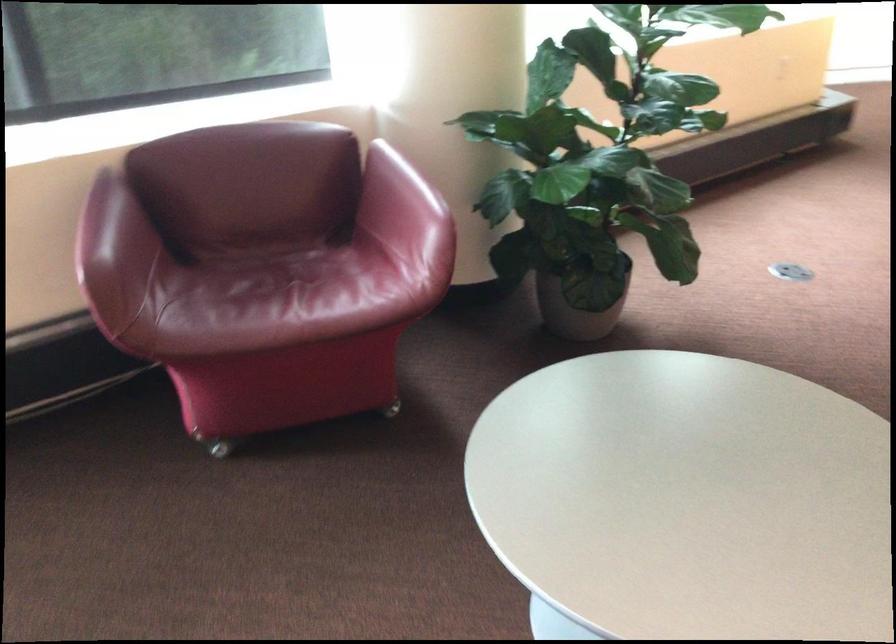
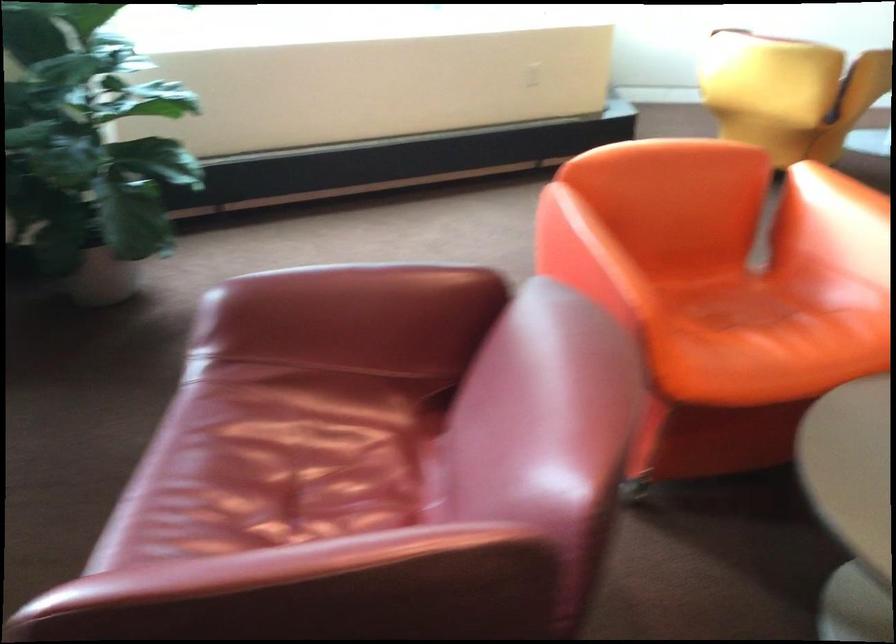
Question: In a continuous first-person perspective shot, in which direction is the camera moving?

Choices:
 (A) Left
 (B) Right
 (C) Forward
 (D) Backward

Answer: (B)